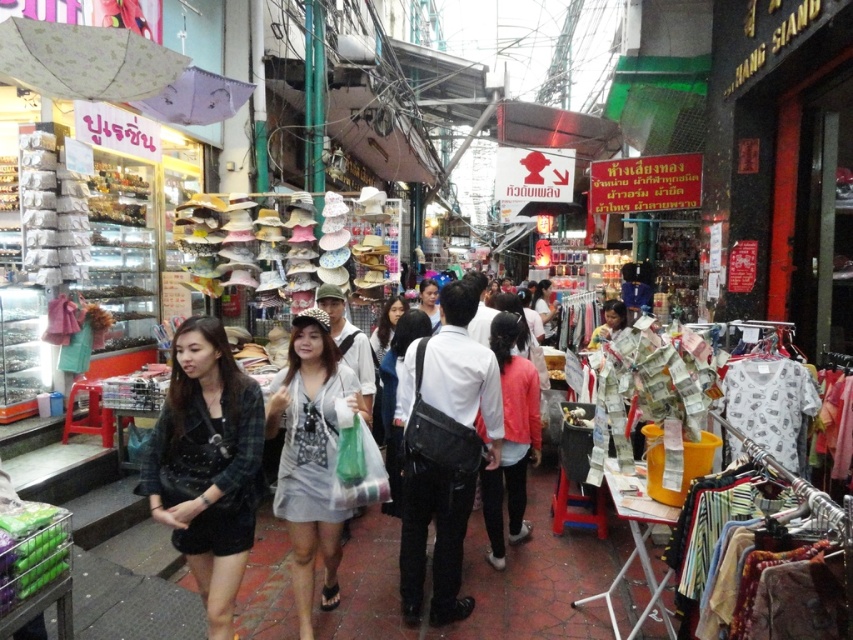
Question: Which is nearer to the matte black shirt at center?

Choices:
 (A) matte white shirt at center
 (B) black fuzzy jacket at lower left

Answer: (A)

Question: Is black fuzzy jacket at lower left positioned in front of matte black shirt at center?

Choices:
 (A) yes
 (B) no

Answer: (A)

Question: Which point appears closest to the camera in this image?

Choices:
 (A) (212, 572)
 (B) (508, 532)

Answer: (A)

Question: Which point is closer to the camera?

Choices:
 (A) white cotton shirt at center
 (B) black fuzzy jacket at lower left
 (C) matte black shirt at center
 (D) matte pink jacket at center

Answer: (B)

Question: Is white cotton shirt at center in front of matte white shirt at center?

Choices:
 (A) yes
 (B) no

Answer: (A)

Question: Is white cotton shirt at center behind matte white shirt at center?

Choices:
 (A) no
 (B) yes

Answer: (A)